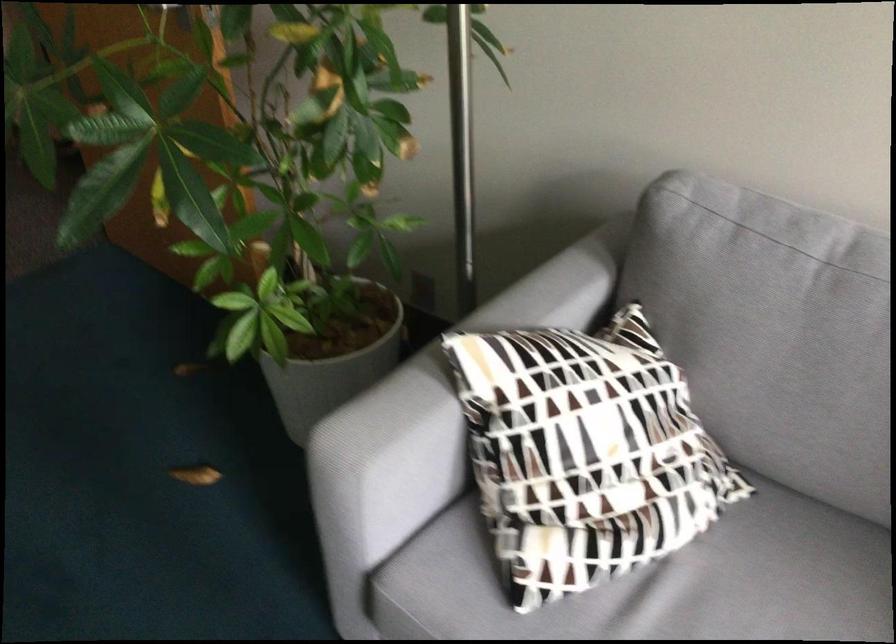
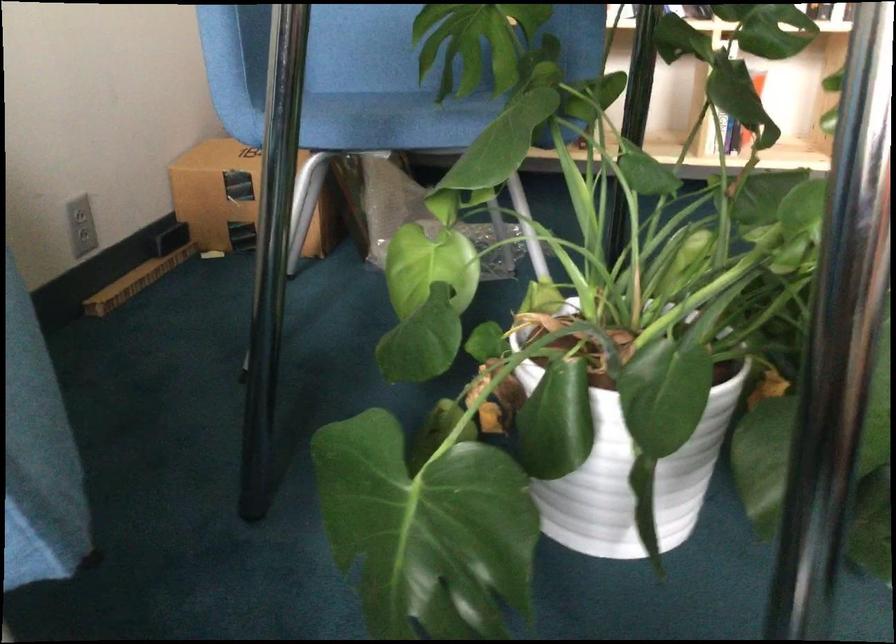
Question: The images are taken continuously from a first-person perspective. In which direction is your viewpoint rotating?

Choices:
 (A) Left
 (B) Right
 (C) Up
 (D) Down

Answer: (A)